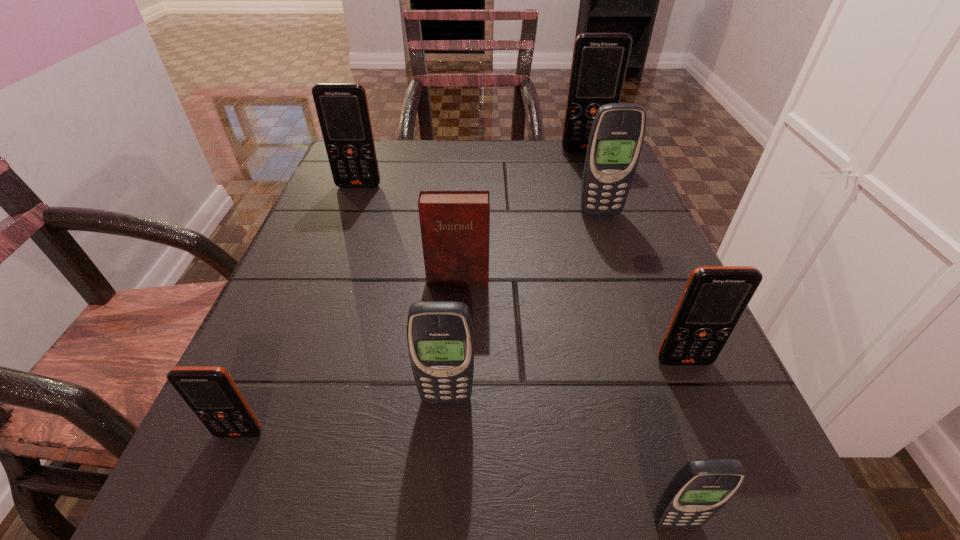
At what (x,y) coordinates should I click in order to perform the action: click on diary. Please return your answer as a coordinate pair (x, y). This screenshot has width=960, height=540. Looking at the image, I should click on (455, 225).

At what (x,y) coordinates should I click in order to perform the action: click on reddish-brown diary. Please return your answer as a coordinate pair (x, y). Looking at the image, I should click on (455, 225).

At what (x,y) coordinates should I click in order to perform the action: click on the second nearest cellular telephone. Please return your answer as a coordinate pair (x, y). Image resolution: width=960 pixels, height=540 pixels. Looking at the image, I should click on (211, 393).

The width and height of the screenshot is (960, 540). What are the coordinates of `the second nearest object` in the screenshot? It's located at (211, 393).

Locate an element on the screen. This screenshot has height=540, width=960. the smallest gray cellular telephone is located at coordinates (701, 488).

Where is `the nearest cellular telephone`? the nearest cellular telephone is located at coordinates (701, 488).

Locate an element on the screen. The height and width of the screenshot is (540, 960). free space located 0.210m on the screen of the tallest cellular telephone is located at coordinates (603, 200).

Identify the location of vacant space located 0.300m on the screen of the second biggest orange cellular telephone. Image resolution: width=960 pixels, height=540 pixels. (323, 282).

In order to click on free space located 0.280m on the screen of the farthest gray cellular telephone in this screenshot , I will do `click(636, 319)`.

Where is `vacant space located on the screen of the third nearest cellular telephone`? The width and height of the screenshot is (960, 540). vacant space located on the screen of the third nearest cellular telephone is located at coordinates (441, 490).